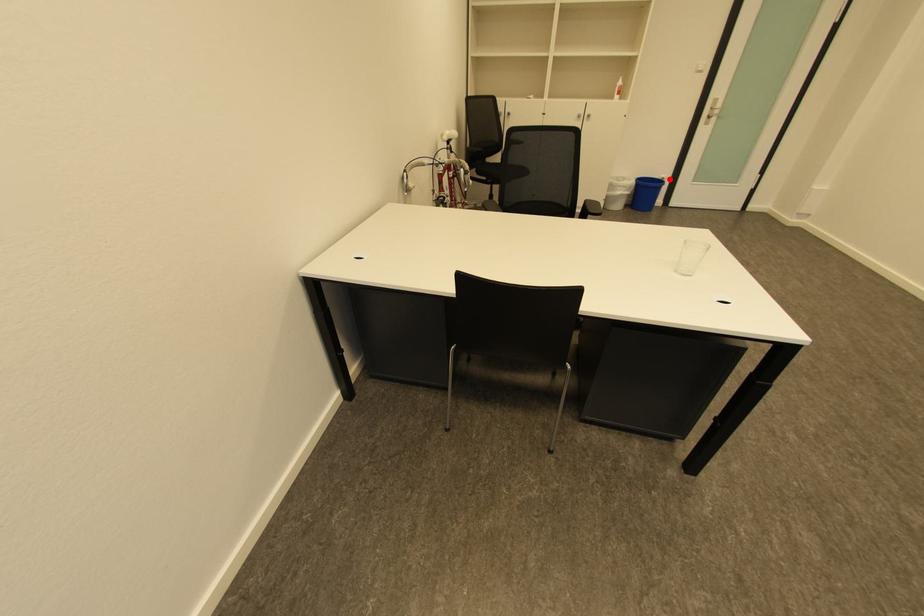
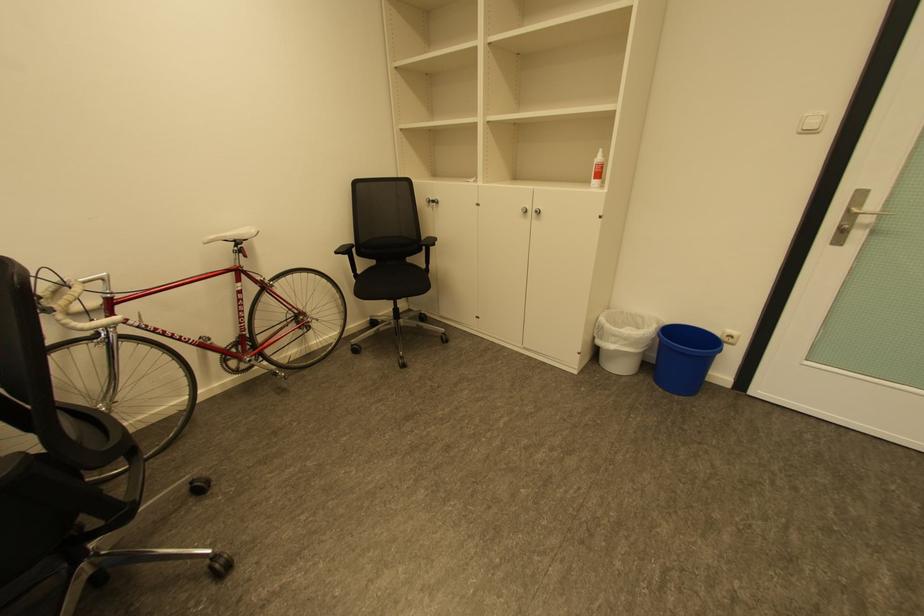
Find the pixel in the second image that matches the highlighted location in the first image.

(737, 337)